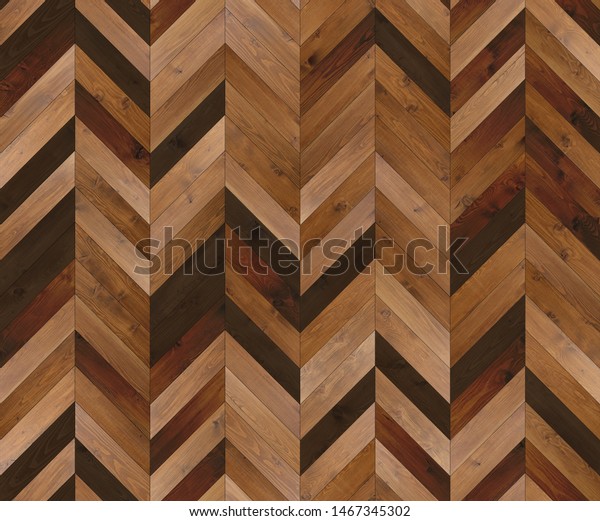
This screenshot has height=521, width=600. Identify the location of wood piece. (45, 54), (136, 362), (287, 352), (349, 355), (451, 338), (443, 359), (552, 372).